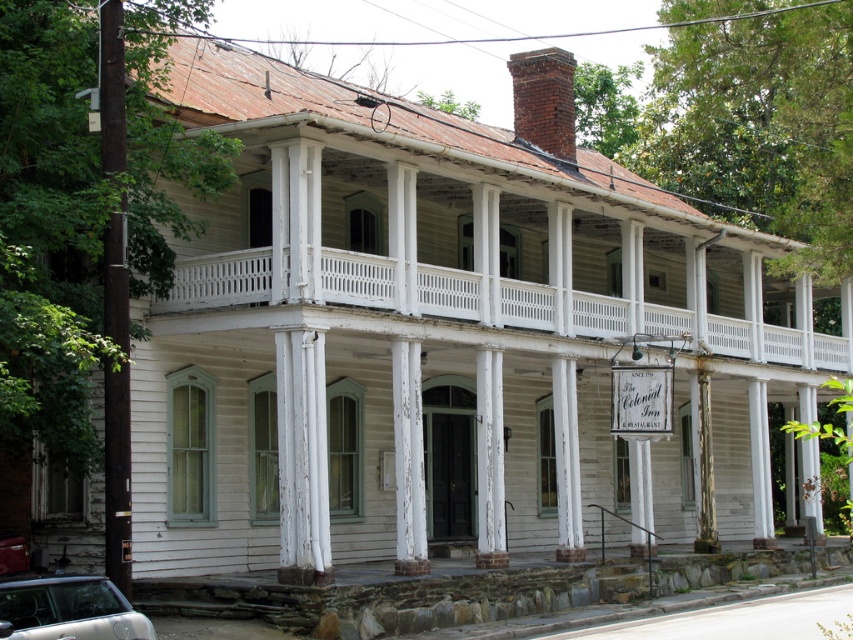
You are standing in front of the two story building and want to touch both the brick chimney at upper center and the white weathered wood at center. Which object will you reach first?

The brick chimney at upper center is closer to you than the white weathered wood at center, so you will reach the brick chimney at upper center first.